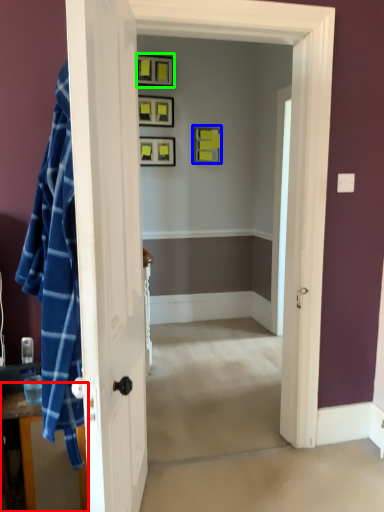
Question: Estimate the real-world distances between objects in this image. Which object is farther from dresser (highlighted by a red box), picture frame (highlighted by a blue box) or picture frame (highlighted by a green box)?

Choices:
 (A) picture frame
 (B) picture frame

Answer: (B)